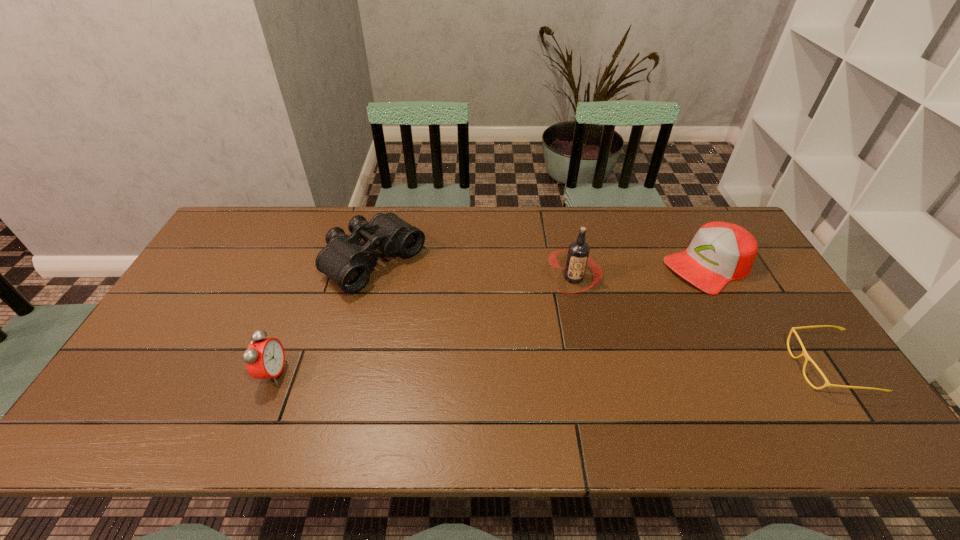
You are a GUI agent. You are given a task and a screenshot of the screen. Output one action in this format:
    pyautogui.click(x=<x>, y=<y>)
    Task: Click on the free spot between the binoculars and the alarm clock
    Image resolution: width=960 pixels, height=540 pixels.
    Given the screenshot: What is the action you would take?
    [324, 318]

The width and height of the screenshot is (960, 540). What are the coordinates of `vacant space that is in between the shortest object and the binoculars` in the screenshot? It's located at (601, 315).

You are a GUI agent. You are given a task and a screenshot of the screen. Output one action in this format:
    pyautogui.click(x=<x>, y=<y>)
    Task: Click on the unoccupied position between the binoculars and the shortest object
    This screenshot has width=960, height=540.
    Given the screenshot: What is the action you would take?
    pyautogui.click(x=601, y=315)

You are a GUI agent. You are given a task and a screenshot of the screen. Output one action in this format:
    pyautogui.click(x=<x>, y=<y>)
    Task: Click on the free space between the alarm clock and the spectacles
    
    Given the screenshot: What is the action you would take?
    pyautogui.click(x=550, y=370)

You are a GUI agent. You are given a task and a screenshot of the screen. Output one action in this format:
    pyautogui.click(x=<x>, y=<y>)
    Task: Click on the third closest object to the binoculars
    
    Given the screenshot: What is the action you would take?
    720,252

Locate which object is the closest to the binoculars. Please provide its 2D coordinates. Your answer should be formatted as a tuple, i.e. [(x, y)], where the tuple contains the x and y coordinates of a point satisfying the conditions above.

[(264, 358)]

The width and height of the screenshot is (960, 540). In order to click on vacant space that satisfies the following two spatial constraints: 1. on the front side of the tallest object; 2. in front of the lenses of the shortest object in this screenshot , I will do `click(593, 367)`.